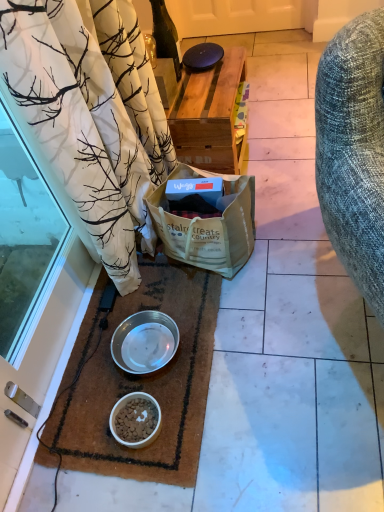
This screenshot has height=512, width=384. I want to click on vacant space in front of metallic silver bowl at lower center, acting as the 2th bowl starting from the bottom, so click(155, 399).